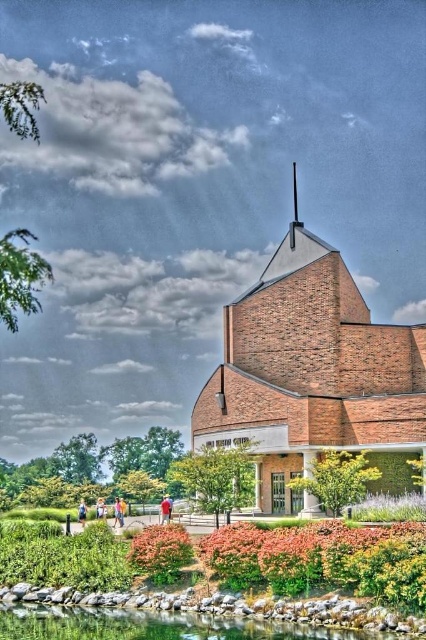
You are standing in front of the brick building at center and want to take a photo of the pink fabric dress at lower center. Since the building is in the way, can you move to the side to get a clear shot of the dress without the building blocking it?

The brick building at center is in front of the pink fabric dress at lower center, so moving to the side might allow you to position yourself where the building no longer blocks the view of the dress.

You are standing in front of a modern brick building with a garden. You see a point labeled as point (195, 621). What is located at that point?

The point (195, 621) indicates clear glass water at lower center.